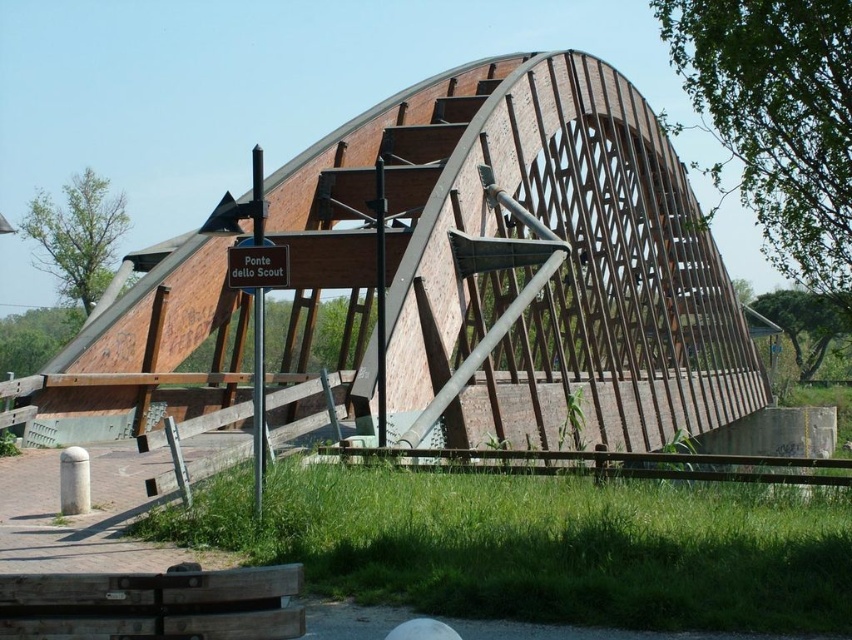
Question: Does brick/concrete bridge at center have a greater width compared to brown wooden sign at center?

Choices:
 (A) yes
 (B) no

Answer: (A)

Question: Which point is closer to the camera?

Choices:
 (A) brick/concrete bridge at center
 (B) brown wooden sign at center

Answer: (B)

Question: Which of the following is the farthest from the observer?

Choices:
 (A) brown wooden sign at center
 (B) brick/concrete bridge at center

Answer: (B)

Question: Is brick/concrete bridge at center bigger than brown wooden sign at center?

Choices:
 (A) no
 (B) yes

Answer: (B)

Question: Can you confirm if brick/concrete bridge at center is positioned below brown wooden sign at center?

Choices:
 (A) no
 (B) yes

Answer: (B)